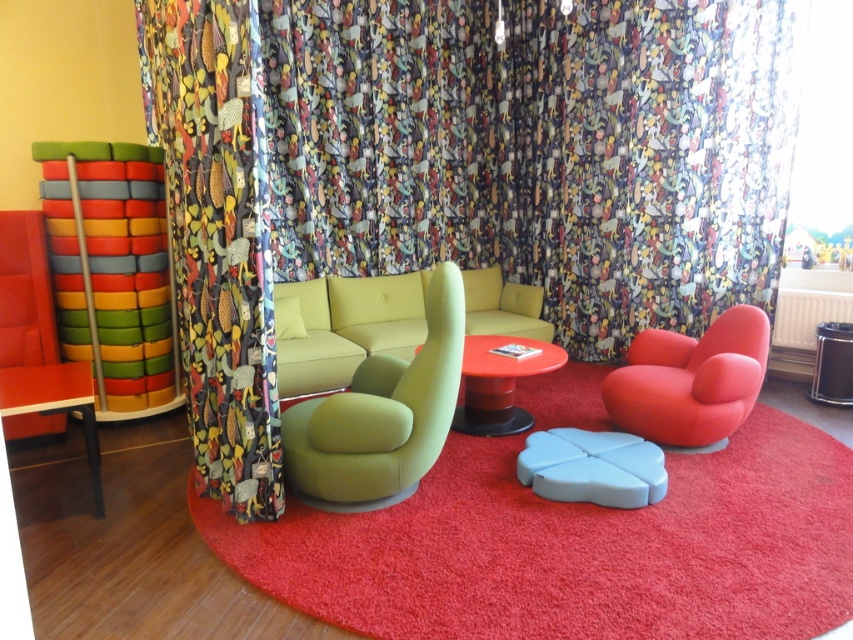
Question: Which object is positioned closest to the matte red swivel chair at lower right?

Choices:
 (A) light blue plastic stool at center
 (B) matte green swivel chair at center
 (C) matte red table at center
 (D) matte green couch at center

Answer: (A)

Question: Which object is closer to the camera taking this photo?

Choices:
 (A) matte green swivel chair at center
 (B) matte red table at center
 (C) matte red swivel chair at lower right
 (D) floral fabric curtain at center

Answer: (A)

Question: Estimate the real-world distances between objects in this image. Which object is closer to the matte green swivel chair at center?

Choices:
 (A) matte red swivel chair at lower right
 (B) matte red table at center
 (C) light blue plastic stool at center

Answer: (C)

Question: Considering the relative positions of floral fabric curtain at center and matte green couch at center in the image provided, where is floral fabric curtain at center located with respect to matte green couch at center?

Choices:
 (A) left
 (B) right

Answer: (B)

Question: Can you confirm if floral fabric curtain at center is wider than matte green swivel chair at center?

Choices:
 (A) no
 (B) yes

Answer: (B)

Question: Is matte green swivel chair at center smaller than matte green couch at center?

Choices:
 (A) no
 (B) yes

Answer: (B)